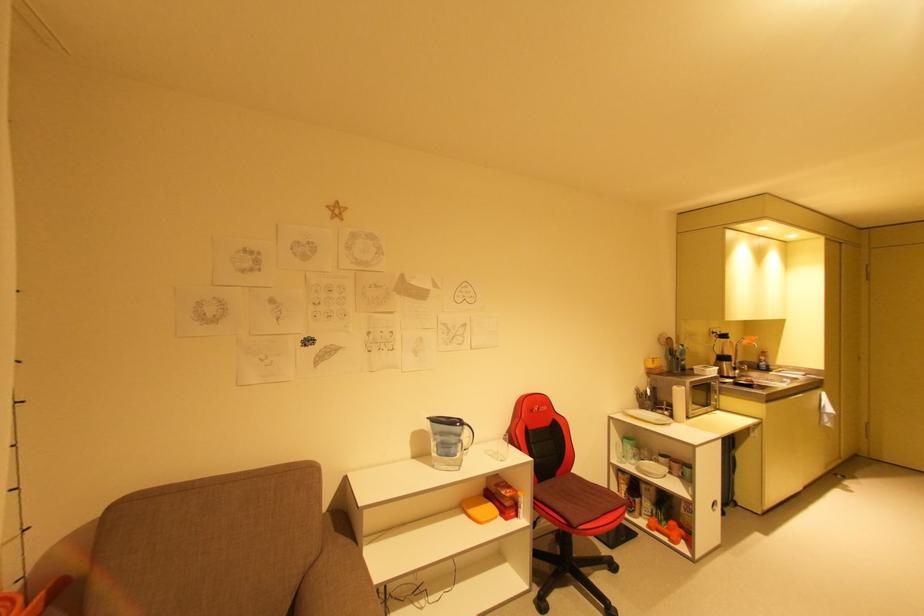
Locate an element on the screen. The height and width of the screenshot is (616, 924). orange pump head is located at coordinates (667, 531).